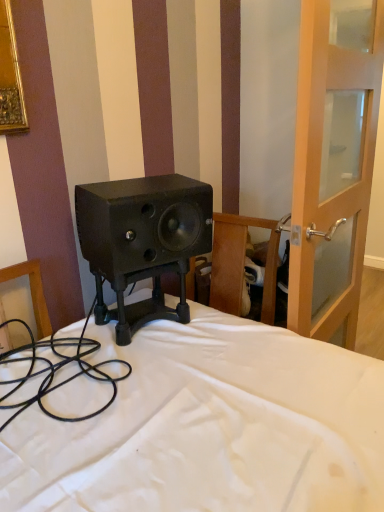
Question: Choose the correct answer: Is black matte speaker at center inside transparent glass door at right or outside it?

Choices:
 (A) inside
 (B) outside

Answer: (B)

Question: Would you say black matte speaker at center is to the left or to the right of transparent glass door at right in the picture?

Choices:
 (A) left
 (B) right

Answer: (A)

Question: Which object is the farthest from the black matte speaker at center?

Choices:
 (A) black rubber cable at lower left
 (B) transparent glass door at right

Answer: (B)

Question: Which is nearer to the transparent glass door at right?

Choices:
 (A) black matte speaker at center
 (B) black rubber cable at lower left

Answer: (A)